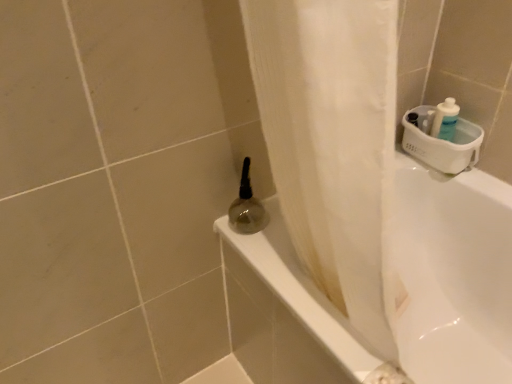
Question: Is translucent glass bottle at upper center completely or partially inside white glossy bathtub at lower right?

Choices:
 (A) yes
 (B) no

Answer: (B)

Question: Does white glossy bathtub at lower right have a smaller size compared to translucent glass bottle at upper center?

Choices:
 (A) no
 (B) yes

Answer: (A)

Question: Can you confirm if white glossy bathtub at lower right is bigger than translucent glass bottle at upper center?

Choices:
 (A) no
 (B) yes

Answer: (B)

Question: From a real-world perspective, is white glossy bathtub at lower right on top of translucent glass bottle at upper center?

Choices:
 (A) no
 (B) yes

Answer: (A)

Question: From a real-world perspective, is white glossy bathtub at lower right positioned under translucent glass bottle at upper center based on gravity?

Choices:
 (A) no
 (B) yes

Answer: (B)

Question: Does white glossy bathtub at lower right turn towards translucent glass bottle at upper center?

Choices:
 (A) yes
 (B) no

Answer: (B)

Question: Does translucent glass bottle at upper center turn towards white glossy bathtub at lower right?

Choices:
 (A) no
 (B) yes

Answer: (A)

Question: From the image's perspective, is translucent glass bottle at upper center below white glossy bathtub at lower right?

Choices:
 (A) no
 (B) yes

Answer: (A)

Question: Does translucent glass bottle at upper center have a smaller size compared to white glossy bathtub at lower right?

Choices:
 (A) yes
 (B) no

Answer: (A)

Question: Does translucent glass bottle at upper center appear on the left side of white glossy bathtub at lower right?

Choices:
 (A) yes
 (B) no

Answer: (A)

Question: Considering the relative sizes of translucent glass bottle at upper center and white glossy bathtub at lower right in the image provided, is translucent glass bottle at upper center wider than white glossy bathtub at lower right?

Choices:
 (A) no
 (B) yes

Answer: (A)

Question: Is translucent glass bottle at upper center looking in the opposite direction of white glossy bathtub at lower right?

Choices:
 (A) yes
 (B) no

Answer: (B)

Question: In terms of size, does white glossy bathtub at lower right appear bigger or smaller than translucent glass bottle at upper center?

Choices:
 (A) small
 (B) big

Answer: (B)